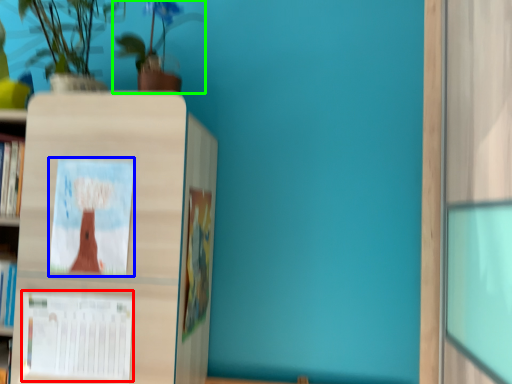
Question: Considering the real-world distances, which object is farthest from book cover (highlighted by a red box)? book cover (highlighted by a blue box) or houseplant (highlighted by a green box)?

Choices:
 (A) book cover
 (B) houseplant

Answer: (B)